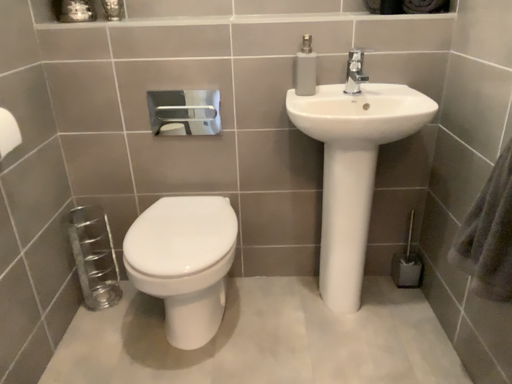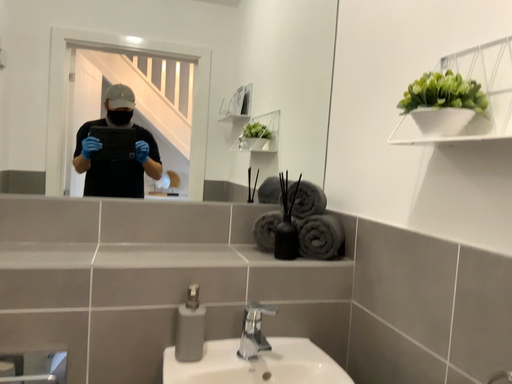
Question: Which way did the camera rotate in the video?

Choices:
 (A) rotated upward
 (B) rotated downward

Answer: (A)